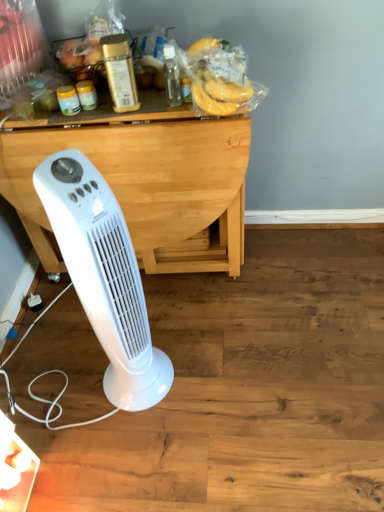
Locate an element on the screen. This screenshot has width=384, height=512. free space to the right of white plastic tower fan at lower left is located at coordinates (199, 372).